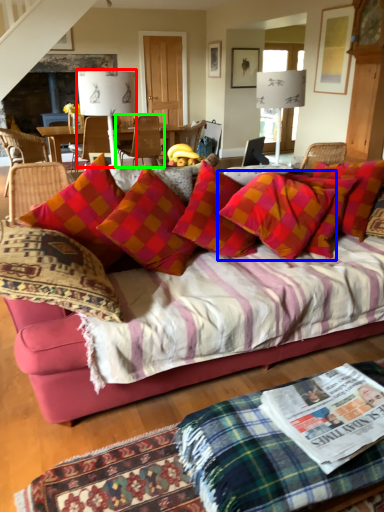
Question: Based on their relative distances, which object is nearer to lamp (highlighted by a red box)? Choose from pillow (highlighted by a blue box) and chair (highlighted by a green box).

Choices:
 (A) pillow
 (B) chair

Answer: (A)